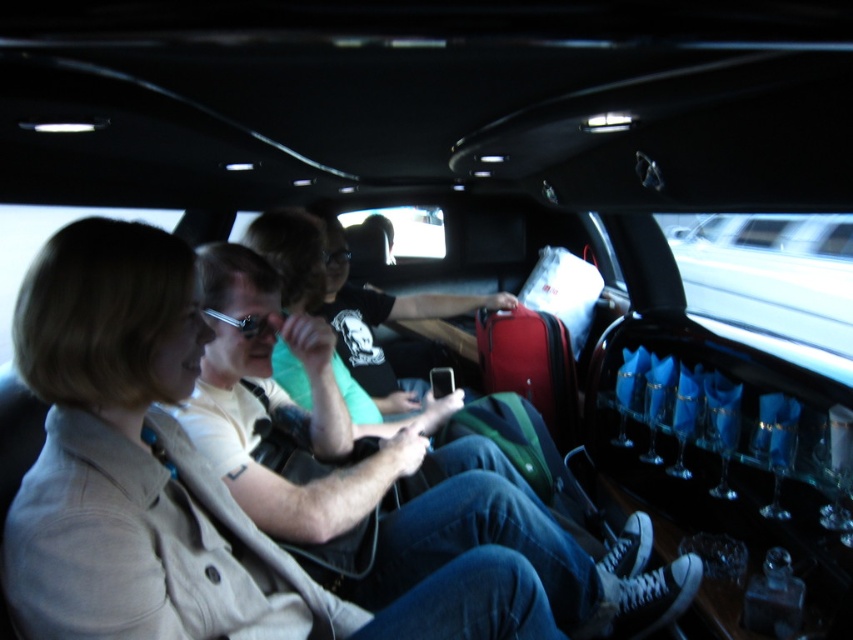
Between light beige jacket at center and matte black phone at center, which one is positioned lower?

light beige jacket at center is below.

Who is more distant from viewer, (113, 316) or (444, 308)?

The point (444, 308) is behind.

Where is `light beige jacket at center`? light beige jacket at center is located at coordinates (177, 481).